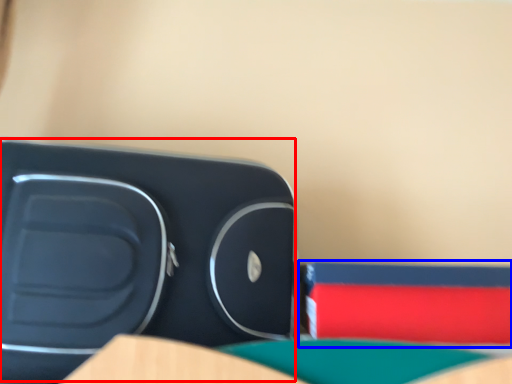
Question: Among these objects, which one is nearest to the camera, turquoise (highlighted by a red box) or paperback book (highlighted by a blue box)?

Choices:
 (A) turquoise
 (B) paperback book

Answer: (A)